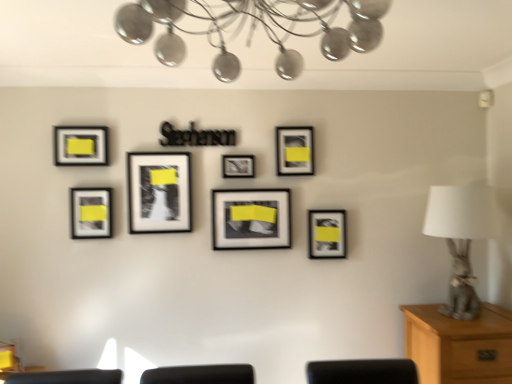
Question: From a real-world perspective, is metallic chandelier at upper center positioned above or below matte black picture frame at lower left, which ranks as the second picture frame in left-to-right order?

Choices:
 (A) below
 (B) above

Answer: (B)

Question: Is metallic chandelier at upper center taller or shorter than matte black picture frame at lower left, which appears as the 6th picture frame when viewed from the right?

Choices:
 (A) tall
 (B) short

Answer: (A)

Question: Considering the real-world distances, which object is farthest from the matte black picture frame at upper center, the sixth picture frame from the left?

Choices:
 (A) matte black picture frame at center, the 3th picture frame from the right
 (B) light brown wooden cabinet at lower right
 (C) matte black picture frame at upper left, which is the first picture frame from left to right
 (D) metallic chandelier at upper center
 (E) matte black picture frame at lower right, the first picture frame in the right-to-left sequence

Answer: (B)

Question: Which of these objects is positioned closest to the light brown wooden cabinet at lower right?

Choices:
 (A) matte black picture frame at upper left, which is the 7th picture frame in right-to-left order
 (B) matte black picture frame at center, the 5th picture frame from the right
 (C) matte black picture frame at lower left, which ranks as the second picture frame in left-to-right order
 (D) matte black picture frame at center, the 3th picture frame from the right
 (E) matte black picture frame at center, marked as the fourth picture frame in a left-to-right arrangement

Answer: (D)